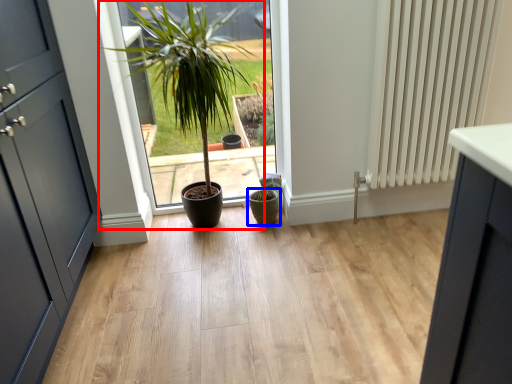
Question: Which point is further to the camera, houseplant (highlighted by a red box) or flowerpot (highlighted by a blue box)?

Choices:
 (A) houseplant
 (B) flowerpot

Answer: (B)